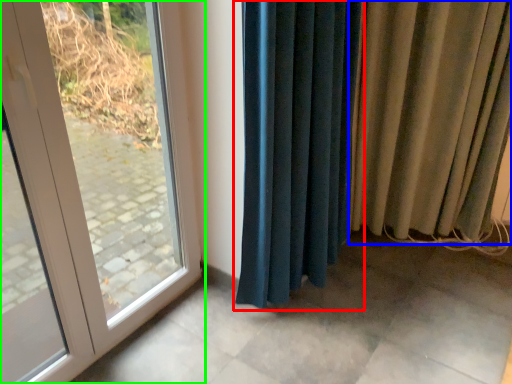
Question: Based on their relative distances, which object is nearer to curtain (highlighted by a red box)? Choose from curtain (highlighted by a blue box) and door (highlighted by a green box).

Choices:
 (A) curtain
 (B) door

Answer: (A)